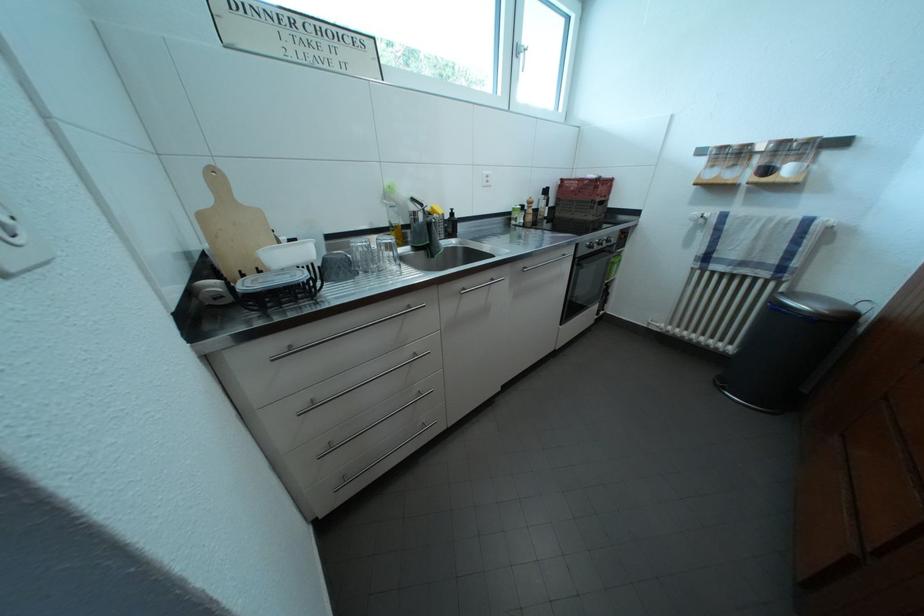
Locate an element on the screen. This screenshot has width=924, height=616. faucet handle is located at coordinates (423, 209).